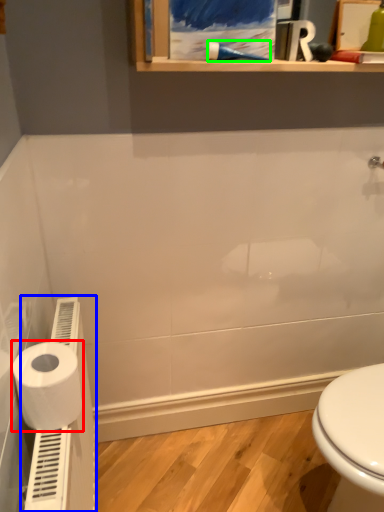
Question: Considering the real-world distances, which object is farthest from toilet paper (highlighted by a red box)? water heater (highlighted by a blue box) or shower (highlighted by a green box)?

Choices:
 (A) water heater
 (B) shower

Answer: (B)